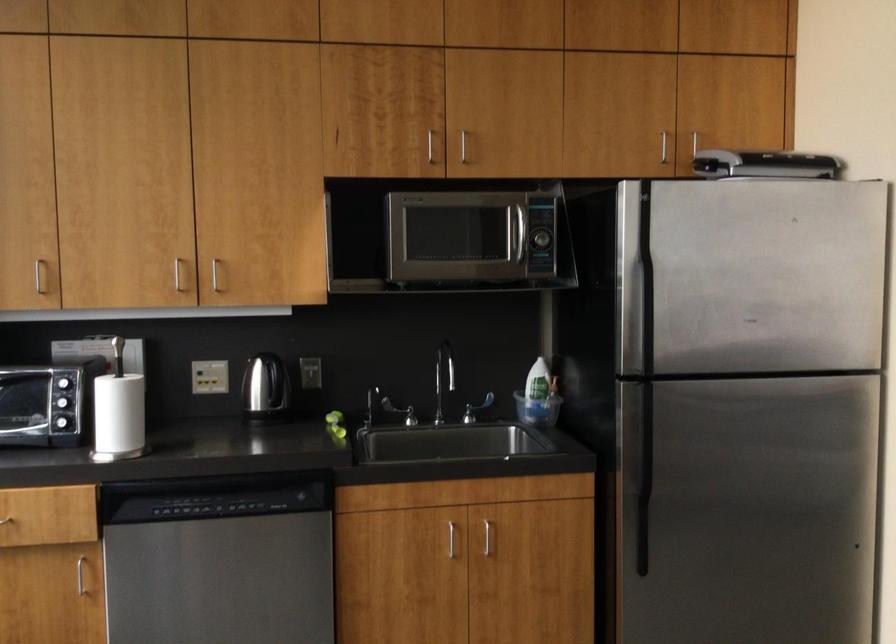
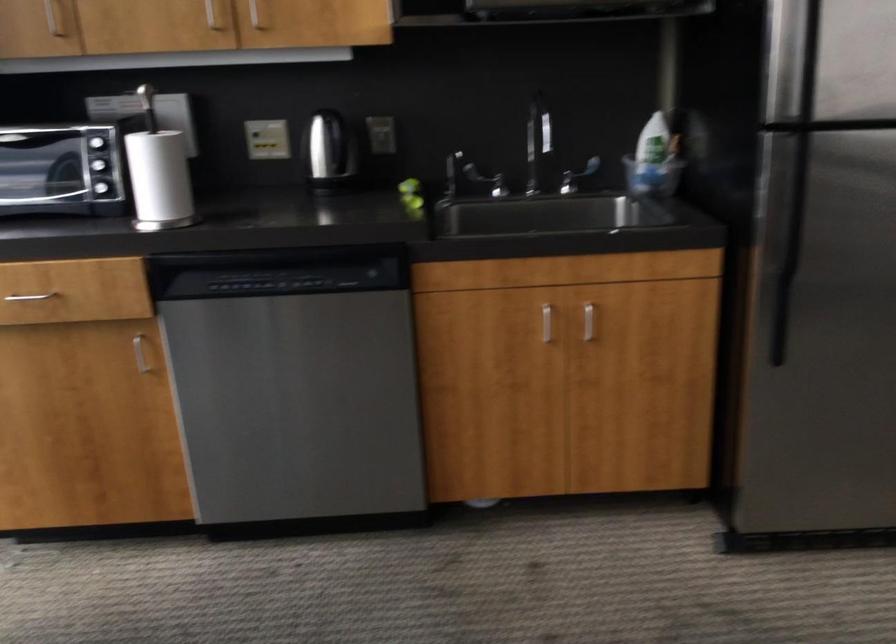
In the second image, find the point that corresponds to (x=476, y=410) in the first image.

(576, 176)